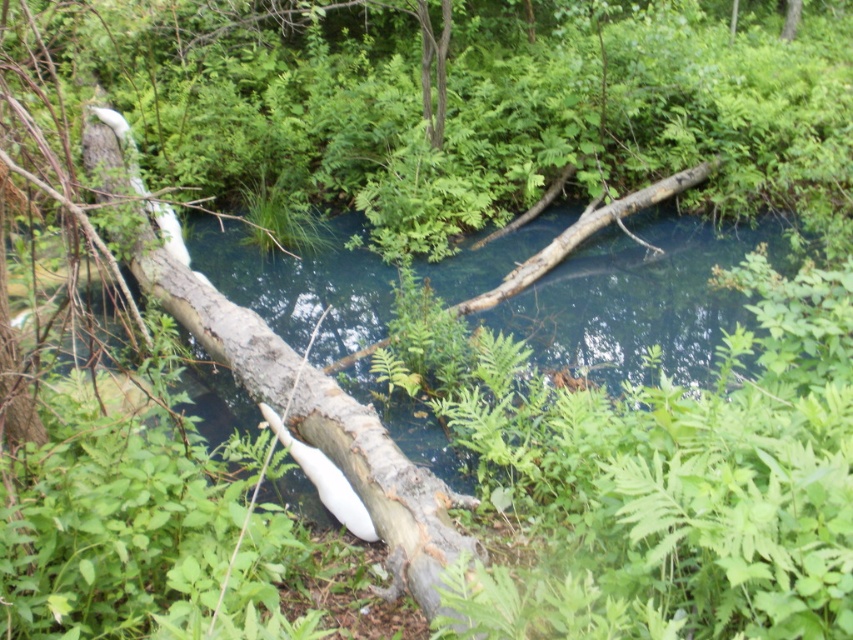
Can you confirm if clear water at center is shorter than smooth gray log at center?

Yes.

Does clear water at center come behind smooth gray log at center?

Yes, clear water at center is further from the viewer.

Which is in front, point (602, 330) or point (184, 324)?

Point (184, 324) is more forward.

What are the coordinates of `clear water at center` in the screenshot? It's located at (639, 298).